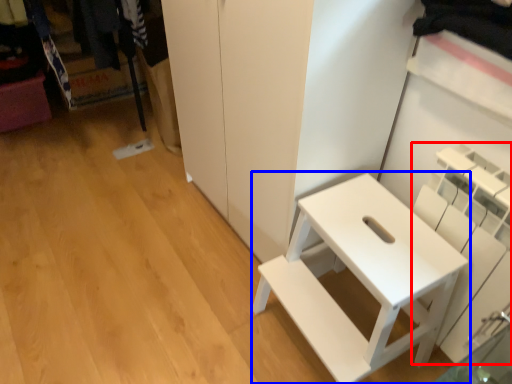
Question: Which object is closer to the camera taking this photo, shelf (highlighted by a red box) or furniture (highlighted by a blue box)?

Choices:
 (A) shelf
 (B) furniture

Answer: (A)